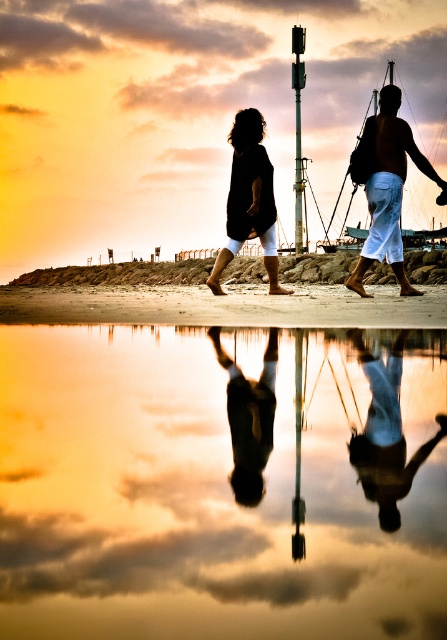
Question: Which is nearer to the black matte clothing at center?

Choices:
 (A) black matte dress at center
 (B) reflective smooth water at center
 (C) silvery reflective surface at center

Answer: (A)

Question: Does black matte clothing at center lie behind silvery reflective surface at center?

Choices:
 (A) no
 (B) yes

Answer: (B)

Question: Which point is farther from the camera taking this photo?

Choices:
 (A) (249, 449)
 (B) (260, 584)

Answer: (A)

Question: Can you confirm if reflective smooth water at center is positioned above matte brown shirt at center?

Choices:
 (A) yes
 (B) no

Answer: (B)

Question: Is matte brown shirt at center closer to camera compared to silvery reflective surface at center?

Choices:
 (A) yes
 (B) no

Answer: (B)

Question: Which object is closer to the camera taking this photo?

Choices:
 (A) black matte dress at center
 (B) silvery reflective surface at center
 (C) smooth skin figure at center
 (D) reflective smooth water at center

Answer: (D)